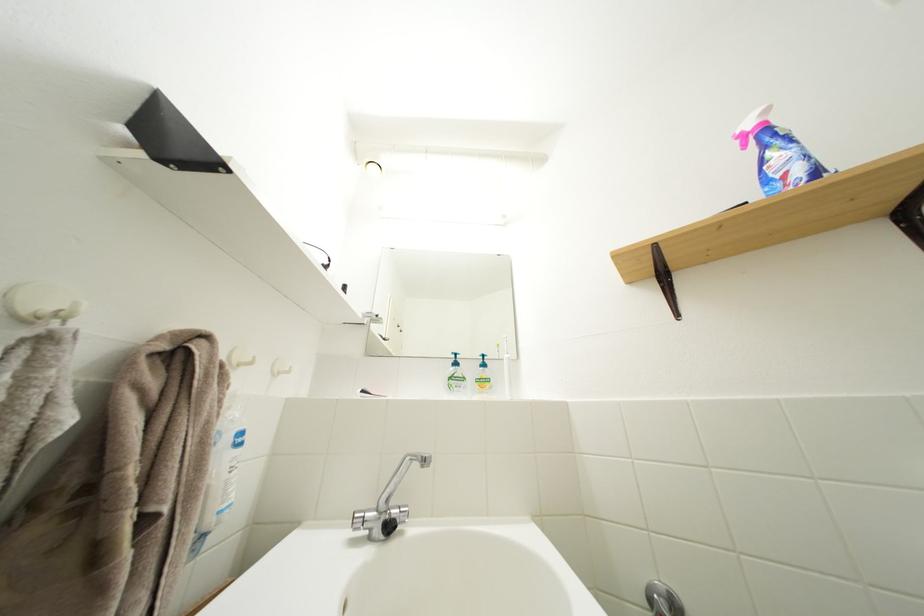
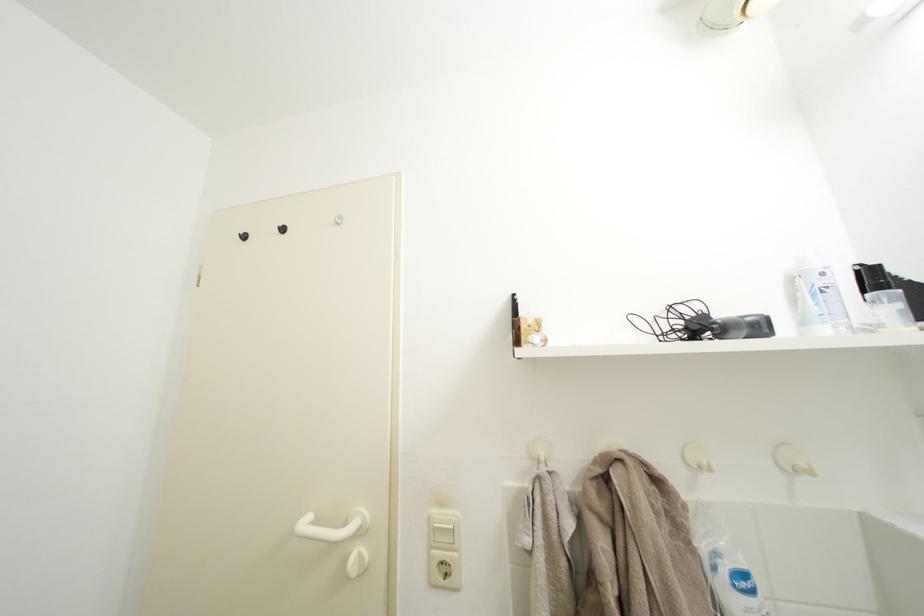
How did the camera likely rotate?

The camera's rotation is toward left-up.